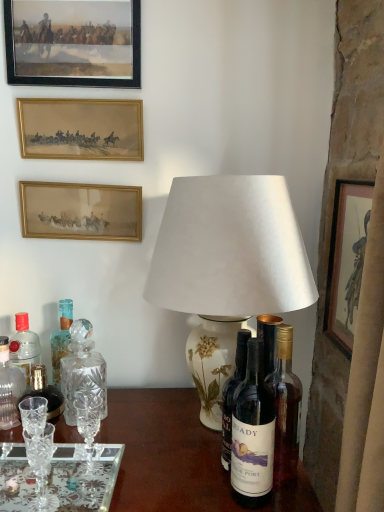
Question: Is wooden frame at upper left, the fourth picture frame when ordered from bottom to top, facing away from clear glass decanter at left, which is the first bottle in left-to-right order?

Choices:
 (A) yes
 (B) no

Answer: (B)

Question: Does wooden frame at upper left, the fourth picture frame when ordered from bottom to top, have a greater height compared to clear glass decanter at left, which is counted as the second bottle, starting from the back?

Choices:
 (A) yes
 (B) no

Answer: (A)

Question: Is wooden frame at upper left, positioned as the 1th picture frame in left-to-right order, smaller than clear glass decanter at left, which is counted as the second bottle, starting from the back?

Choices:
 (A) no
 (B) yes

Answer: (A)

Question: Can you confirm if wooden frame at upper left, which is counted as the 1th picture frame, starting from the top, is shorter than clear glass decanter at left, which is counted as the second bottle, starting from the back?

Choices:
 (A) no
 (B) yes

Answer: (A)

Question: From the image's perspective, is wooden frame at upper left, which is counted as the 1th picture frame, starting from the top, beneath clear glass decanter at left, which is the first bottle in left-to-right order?

Choices:
 (A) no
 (B) yes

Answer: (A)

Question: Considering the positions of point (134, 210) and point (74, 28), is point (134, 210) closer or farther from the camera than point (74, 28)?

Choices:
 (A) farther
 (B) closer

Answer: (A)

Question: In terms of width, does gold-framed painting at upper left, positioned as the third picture frame in top-to-bottom order, look wider or thinner when compared to wooden frame at upper left, positioned as the 1th picture frame in left-to-right order?

Choices:
 (A) thin
 (B) wide

Answer: (B)

Question: In the image, is gold-framed painting at upper left, marked as the third picture frame in a right-to-left arrangement, on the left side or the right side of wooden frame at upper left, positioned as the fourth picture frame in right-to-left order?

Choices:
 (A) left
 (B) right

Answer: (B)

Question: From the image's perspective, is gold-framed painting at upper left, the 2th picture frame in the left-to-right sequence, located above or below wooden frame at upper left, which is counted as the 1th picture frame, starting from the top?

Choices:
 (A) below
 (B) above

Answer: (A)

Question: Is clear glass decanter at left, which is counted as the second bottle, starting from the back, inside the boundaries of gold-framed painting at upper left, the 2th picture frame in the left-to-right sequence, or outside?

Choices:
 (A) inside
 (B) outside

Answer: (B)

Question: Would you say clear glass decanter at left, the third bottle in the front-to-back sequence, is to the left or to the right of gold-framed painting at upper left, acting as the 2th picture frame starting from the bottom, in the picture?

Choices:
 (A) left
 (B) right

Answer: (A)

Question: Considering their positions, is clear glass decanter at left, acting as the fourth bottle starting from the right, located in front of or behind gold-framed painting at upper left, acting as the 2th picture frame starting from the bottom?

Choices:
 (A) front
 (B) behind

Answer: (A)

Question: From their relative heights in the image, would you say clear glass decanter at left, the third bottle in the front-to-back sequence, is taller or shorter than gold-framed painting at upper left, marked as the third picture frame in a right-to-left arrangement?

Choices:
 (A) tall
 (B) short

Answer: (A)

Question: Looking at their shapes, would you say wooden frame at upper left, the fourth picture frame when ordered from bottom to top, is wider or thinner than gold-framed painting at upper left, positioned as the third picture frame in top-to-bottom order?

Choices:
 (A) thin
 (B) wide

Answer: (A)

Question: Is wooden frame at upper left, positioned as the fourth picture frame in right-to-left order, taller or shorter than gold-framed painting at upper left, acting as the 2th picture frame starting from the bottom?

Choices:
 (A) tall
 (B) short

Answer: (A)